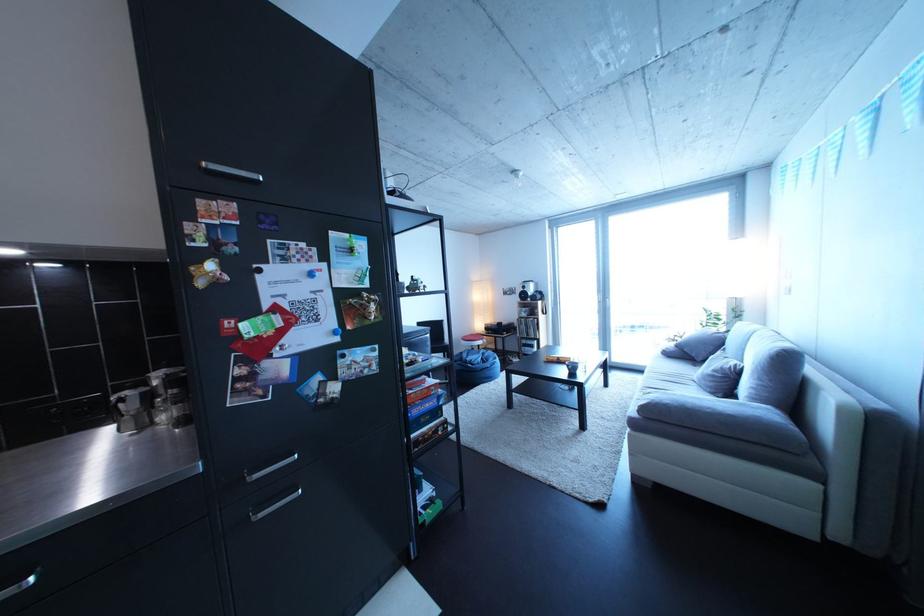
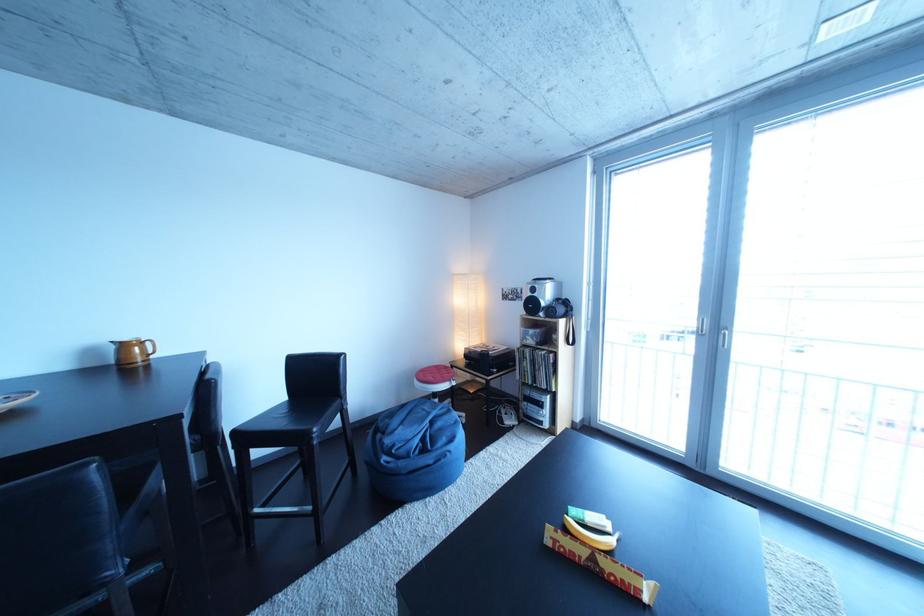
In the second image, find the point that corresponds to (x=550, y=297) in the first image.

(570, 306)